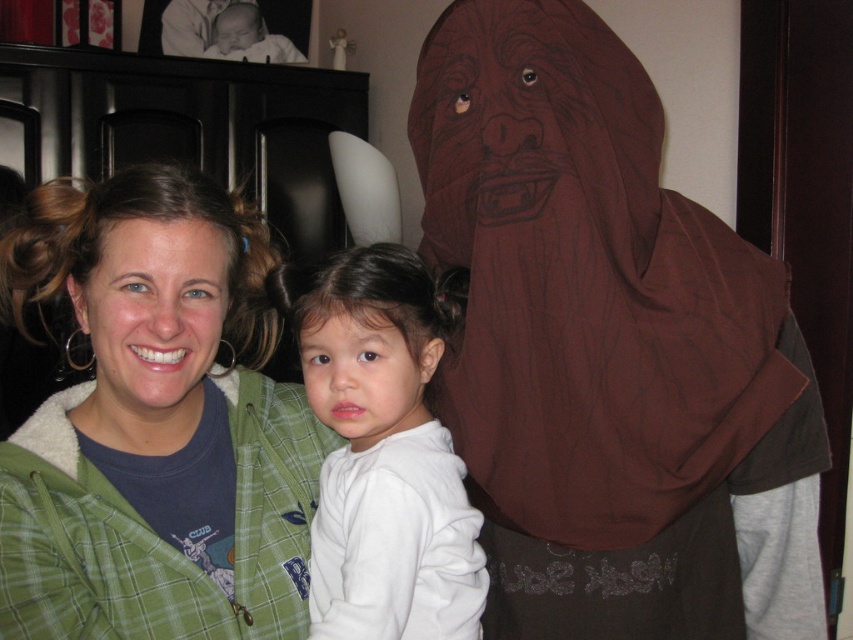
You are standing at the origin of the coordinate system in the image. There are two points marked in the scene. The first point is at position point [511,520] and the second point is at position point [233,371]. Which point is closer to you?

Point [233,371] is closer to you because it is in front of point [511,520].

You are trying to determine which clothing item is visible on top in the image. The options are the green plaid jacket at center and the white soft sweatshirt at center. Which one is on top?

The green plaid jacket at center is positioned over the white soft sweatshirt at center, so the green plaid jacket at center is on top.